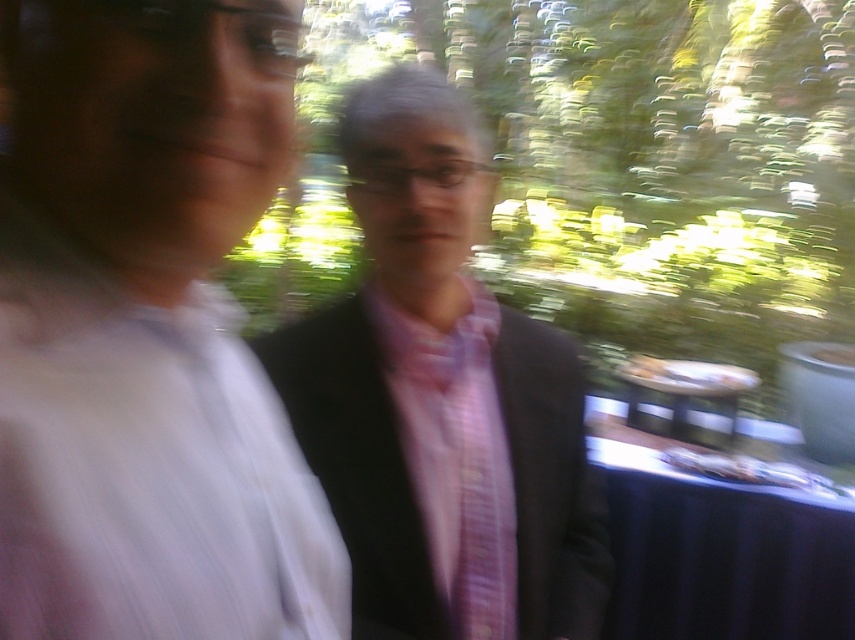
You are planning to place a decorative vase between the matte black suit at center and the blue fabric table at lower right. According to the scene, where should you position the vase so it is equidistant from both objects?

The vase should be placed exactly halfway between the matte black suit at center and the blue fabric table at lower right since the matte black suit at center is to the left of blue fabric table at lower right.

You are organizing a charity event and need to ensure that the attire of the speakers matches the theme. Given the matte black suit at center and pink striped tie at center, which one should you adjust if you want the width of the clothing items to be more balanced?

The matte black suit at center is wider than the pink striped tie at center. To balance the widths, you should adjust the pink striped tie at center to be wider or reduce the width of the matte black suit at center.

You are organizing a photoshoot and need to place a small prop exactly where the pink satin shirt at left is located. According to the coordinates provided, what are the x and y values where you should position the prop?

The coordinates for the pink satin shirt at left are x 0.519 and y 0.173, so you should position the prop at those exact points.